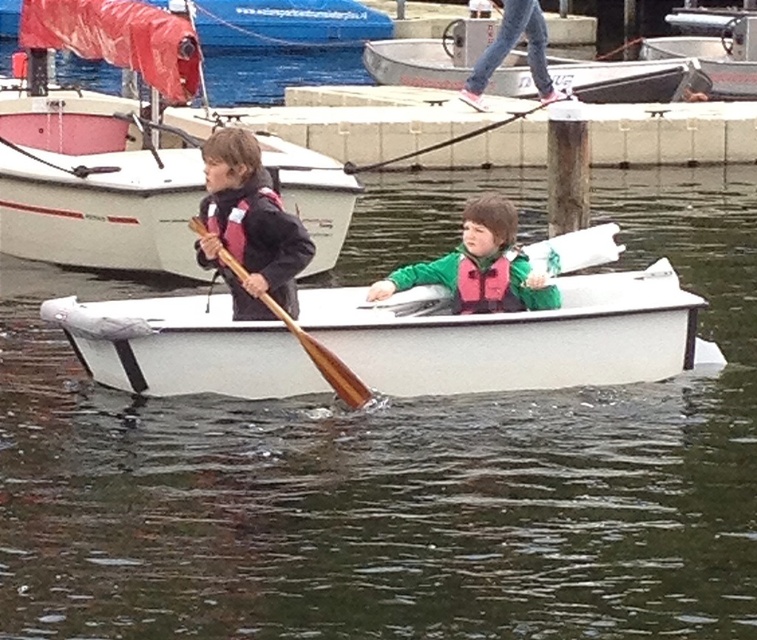
You are a photographer trying to capture the reflection of the matte black life vest at left and the white smooth water at center in the image. Which object should be positioned closer to the camera to ensure its reflection is more prominent in the photo?

The white smooth water at center is to the right of the matte black life vest at left. To make the reflection of the white smooth water at center more prominent, position it closer to the camera since it is already positioned to the right of the matte black life vest at left.

You are standing on the dock and looking at the boat with two children. There is a point marked at coordinates [394,480]. What does this point most likely represent in the scene?

The point at coordinates [394,480] most likely represents the white smooth water at center.

You are standing on the dock and see the point at coordinates point (727, 508). If you want to throw a lifebuoy to that point, and the lifebuoy has a radius of 3 feet, will it reach the point?

The point (727, 508) is 48.20 feet from the camera. The lifebuoy has a radius of 3 feet, so it will not reach the point as the distance is much greater than the lifebuoy radius.